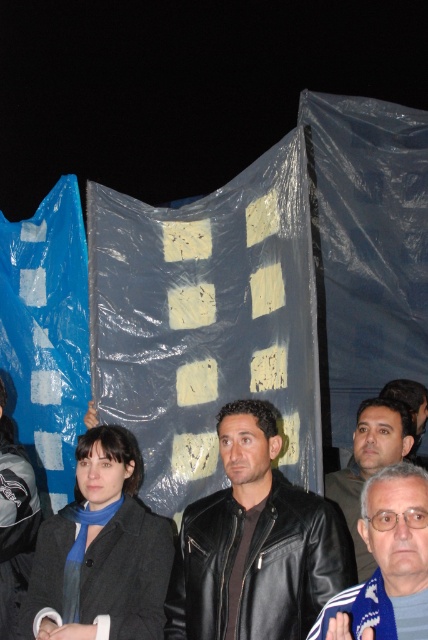
You are a photographer adjusting your camera settings to focus on the jackets. Which jacket, the black leather jacket at lower left or the dark brown leather jacket at lower right, is closer to you?

The black leather jacket at lower left is closer to you because it is further to the viewer than the dark brown leather jacket at lower right.

You are a photographer setting up equipment in the scene. You need to place a 1.5 meter long extension pole between the black leather jacket at lower left and the dark brown leather jacket at lower right. Will the pole fit between them without overlapping either jacket?

The distance between the black leather jacket at lower left and the dark brown leather jacket at lower right is 1.89 meters. Since the pole is 1.5 meters long, it will fit between them with 0.39 meters of space remaining.